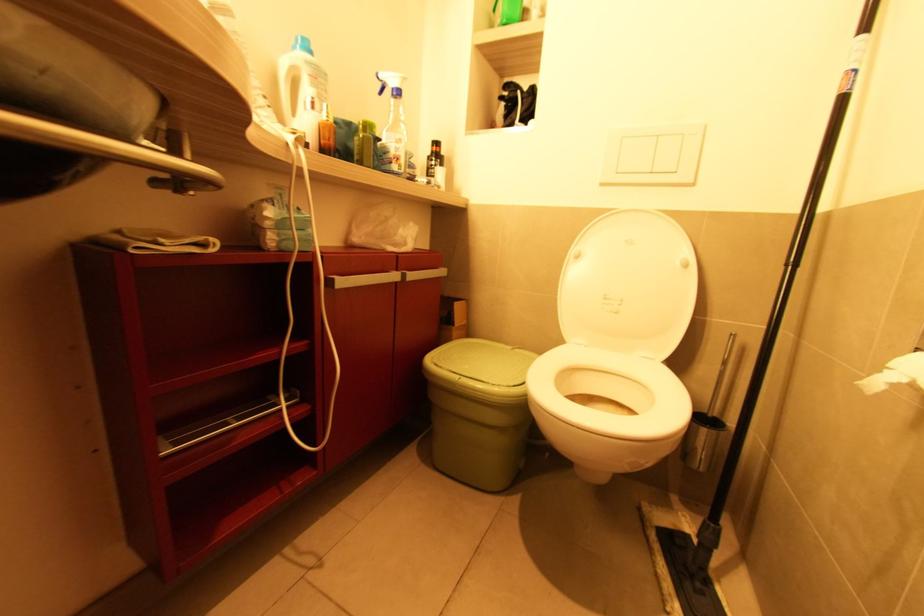
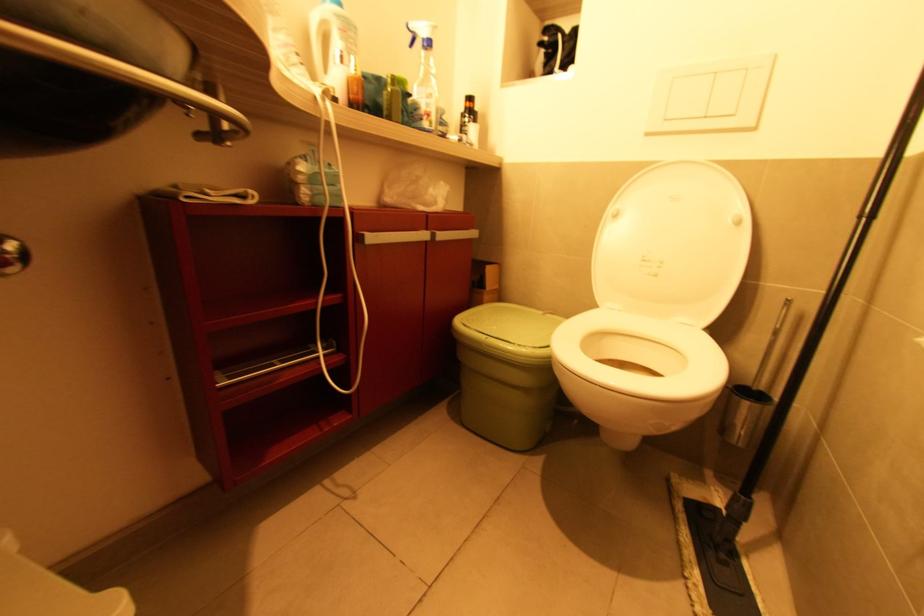
In the second image, find the point that corresponds to point 393,163 in the first image.

(424, 121)